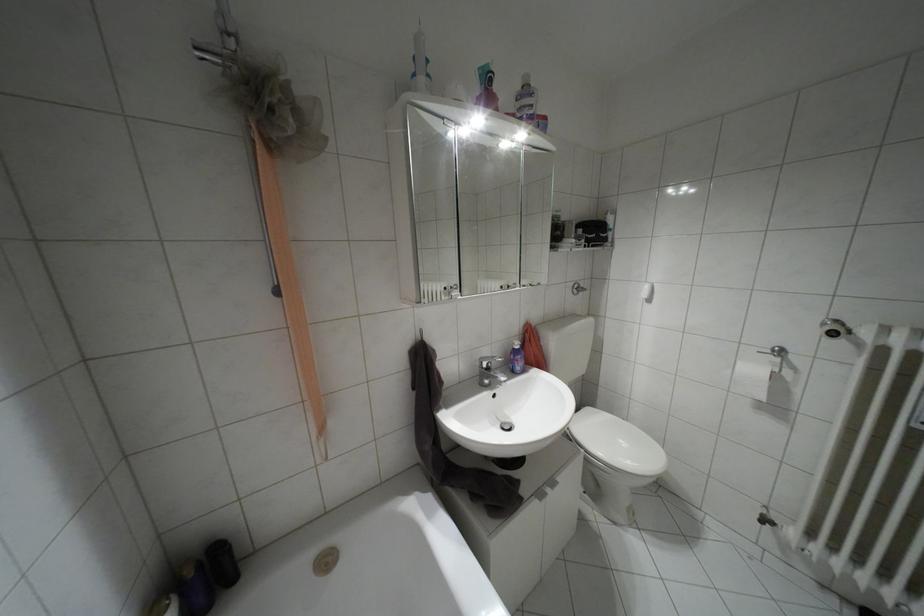
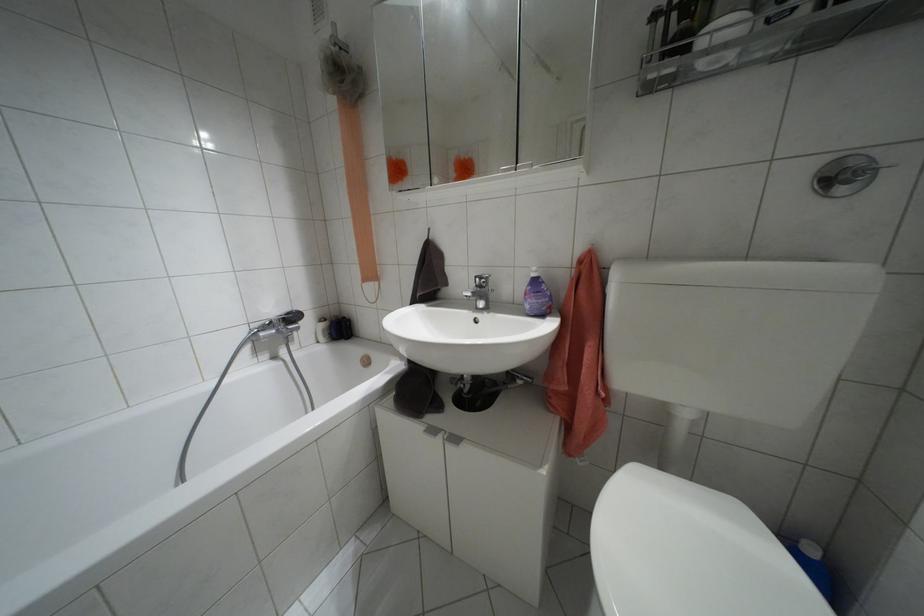
In the second image, find the point that corresponds to (574,292) in the first image.

(841, 190)